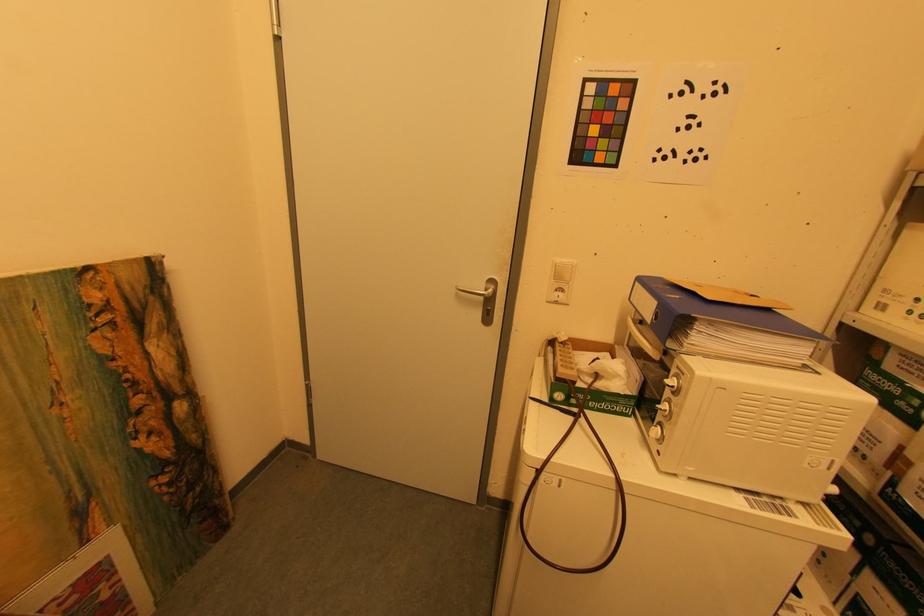
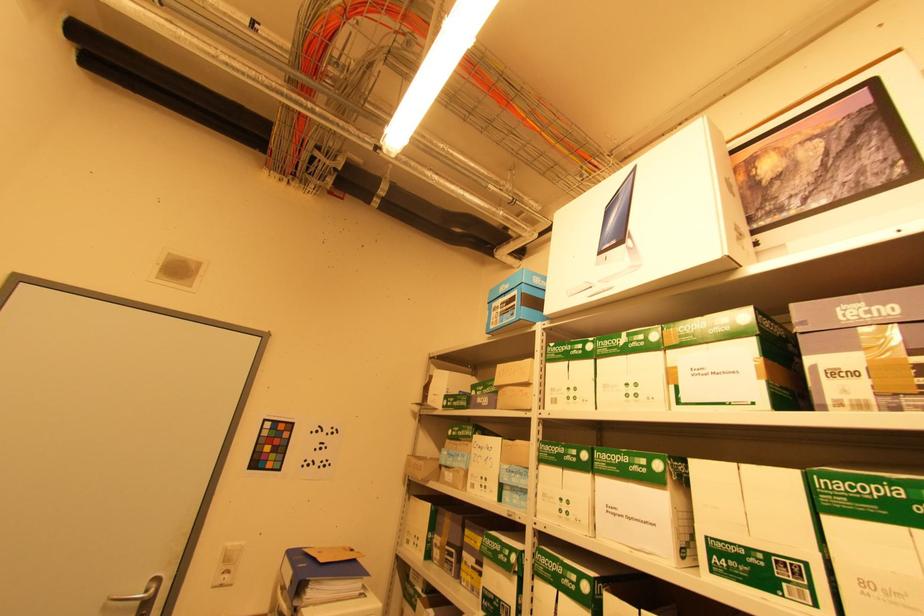
Based on the continuous images, in which direction is the camera rotating?

The camera rotated toward right-up.